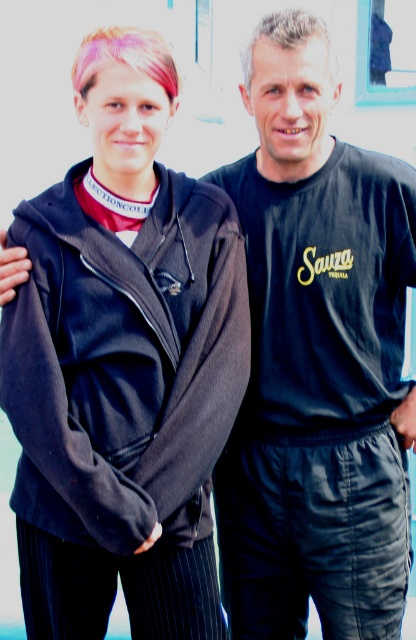
Question: Which point is closer to the camera?

Choices:
 (A) (133, 401)
 (B) (111, 44)

Answer: (B)

Question: Is dark gray fleece sweatshirt at left behind slightly grayish blonde hair at upper center?

Choices:
 (A) yes
 (B) no

Answer: (B)

Question: From the image, what is the correct spatial relationship of dark gray fleece sweatshirt at left in relation to pink dyed hair at upper left?

Choices:
 (A) left
 (B) right

Answer: (A)

Question: Is dark gray fleece sweatshirt at left to the left of slightly grayish blonde hair at upper center from the viewer's perspective?

Choices:
 (A) yes
 (B) no

Answer: (A)

Question: Among these points, which one is nearest to the camera?

Choices:
 (A) (103, 33)
 (B) (326, 26)
 (C) (128, 378)

Answer: (A)

Question: Considering the real-world distances, which object is closest to the pink dyed hair at upper left?

Choices:
 (A) dark gray fleece sweatshirt at left
 (B) slightly grayish blonde hair at upper center

Answer: (B)